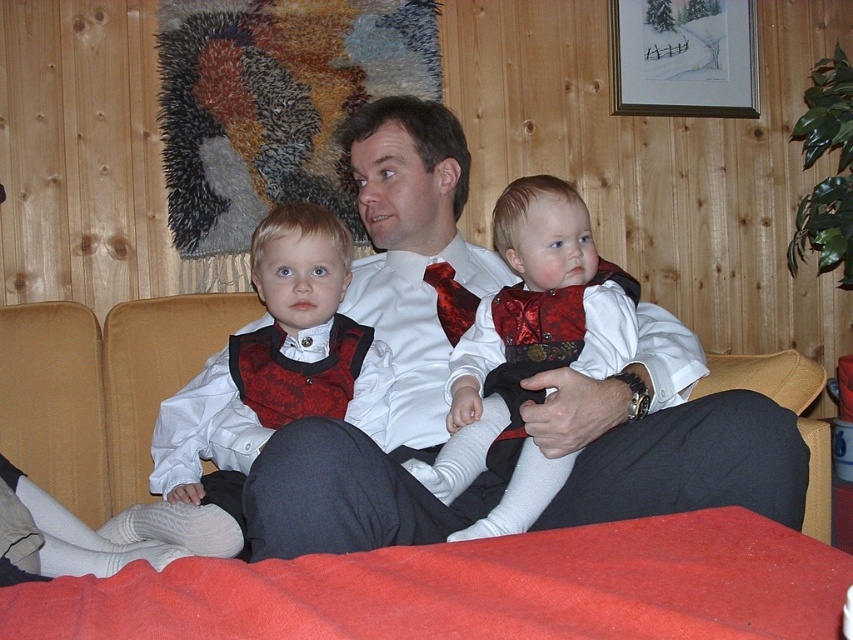
Question: Does white satin shirt at center lie behind matte black vest at left?

Choices:
 (A) yes
 (B) no

Answer: (B)

Question: Does white satin shirt at center have a lesser width compared to red satin tie at center?

Choices:
 (A) yes
 (B) no

Answer: (B)

Question: Which of the following is the farthest from the observer?

Choices:
 (A) (350, 332)
 (B) (444, 304)

Answer: (B)

Question: Can you confirm if matte black vest at left is positioned above matte red vest at center?

Choices:
 (A) no
 (B) yes

Answer: (A)

Question: Which point appears farthest from the camera in this image?

Choices:
 (A) (606, 465)
 (B) (445, 312)

Answer: (B)

Question: Based on their relative distances, which object is nearer to the white satin shirt at center?

Choices:
 (A) red satin tie at center
 (B) matte red vest at center

Answer: (B)